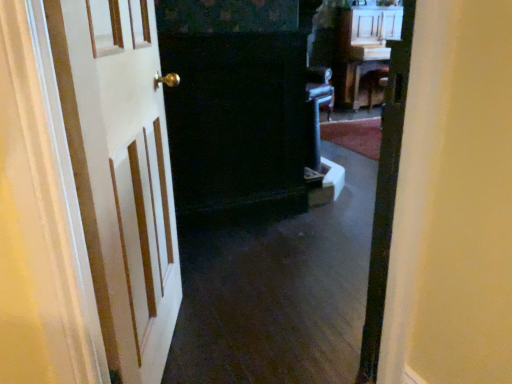
Find the location of `white wooden door at left`. white wooden door at left is located at coordinates (121, 174).

What do you see at coordinates (121, 174) in the screenshot?
I see `white wooden door at left` at bounding box center [121, 174].

In order to face white wooden door at left, should I rotate leftwards or rightwards?

You should rotate left by 13.905 degrees.

The image size is (512, 384). I want to click on white wooden door at left, so click(x=121, y=174).